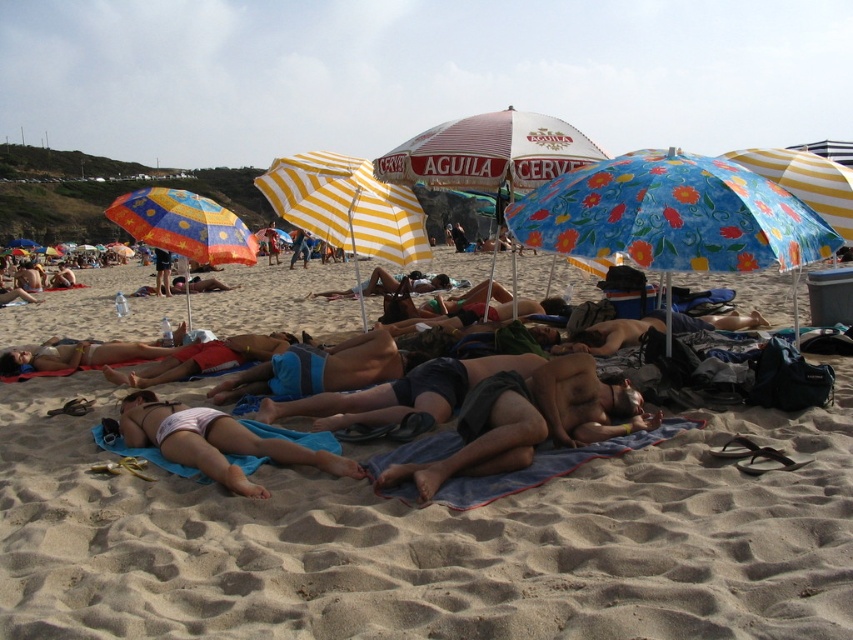
How far apart are floral fabric umbrella at center and white fabric bikini at center?

floral fabric umbrella at center is 8.21 feet from white fabric bikini at center.

Who is shorter, floral fabric umbrella at center or white fabric bikini at center?

With less height is white fabric bikini at center.

Describe the element at coordinates (672, 216) in the screenshot. I see `floral fabric umbrella at center` at that location.

The width and height of the screenshot is (853, 640). What are the coordinates of `floral fabric umbrella at center` in the screenshot? It's located at tap(672, 216).

Is dark gray shorts at center smaller than yellow striped umbrella at center?

Indeed, dark gray shorts at center has a smaller size compared to yellow striped umbrella at center.

Is the position of dark gray shorts at center more distant than that of yellow striped umbrella at center?

That is False.

Between point (471, 454) and point (363, 173), which one is positioned in front?

Point (471, 454) is in front.

You are a GUI agent. You are given a task and a screenshot of the screen. Output one action in this format:
    pyautogui.click(x=<x>, y=<y>)
    Task: Click on the dark gray shorts at center
    This screenshot has height=640, width=853.
    Given the screenshot: What is the action you would take?
    pyautogui.click(x=527, y=420)

Is matte blue towel at center to the right of multicolored fabric umbrella at center-left from the viewer's perspective?

Correct, you'll find matte blue towel at center to the right of multicolored fabric umbrella at center-left.

Between matte blue towel at center and multicolored fabric umbrella at center-left, which one appears on the right side from the viewer's perspective?

matte blue towel at center is more to the right.

What do you see at coordinates (427, 544) in the screenshot? Image resolution: width=853 pixels, height=640 pixels. I see `matte blue towel at center` at bounding box center [427, 544].

The height and width of the screenshot is (640, 853). Identify the location of matte blue towel at center. (427, 544).